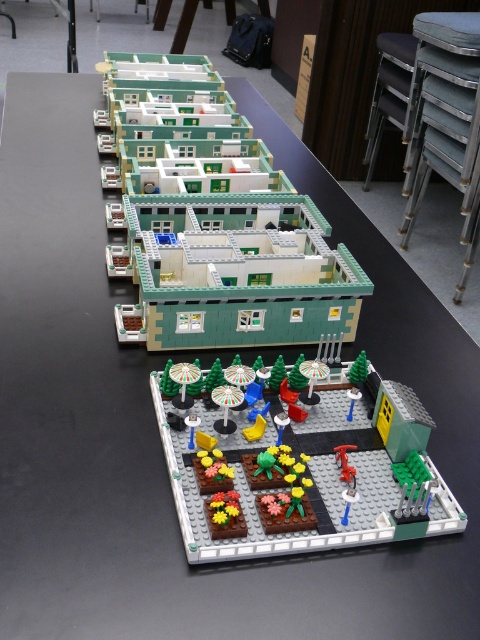
You are a delivery robot with a 12 inch wide package. You need to navigate from the garden area to the entrance of the green matte building at upper center. Is there enough space between the metallic red fire hydrant at center and the building to pass through?

The distance between the green matte building at upper center and the metallic red fire hydrant at center is 28.07 inches. Since the package is 12 inches wide, there is sufficient space for the delivery robot to pass through the gap between them.